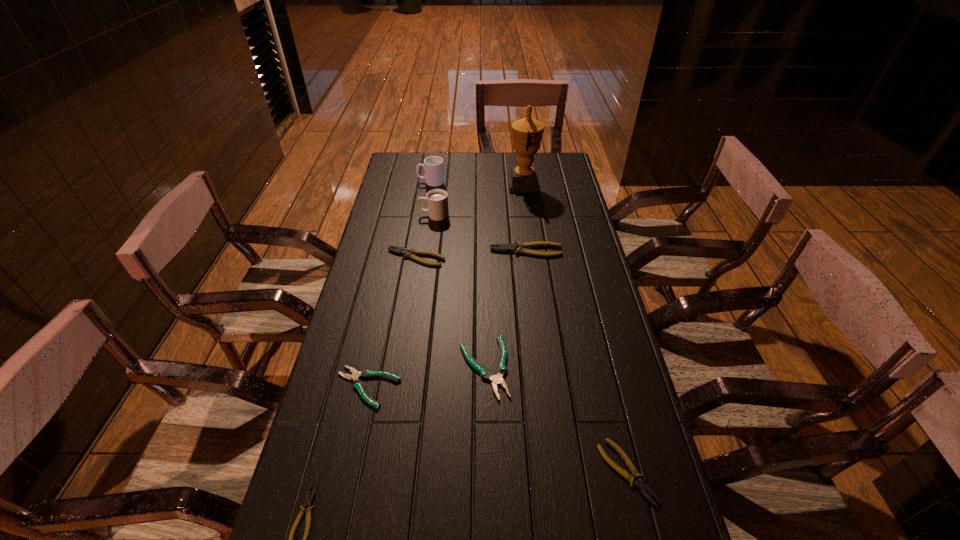
Locate an element on the screen. The height and width of the screenshot is (540, 960). the second smallest yellow pliers is located at coordinates (639, 483).

The image size is (960, 540). I want to click on the smaller teal pliers, so click(357, 384).

Identify the location of free region located at the front of the award with handles. (457, 184).

Find the location of a particular element. vacant position located 0.330m at the front of the award with handles is located at coordinates (431, 184).

At what (x,y) coordinates should I click in order to perform the action: click on vacant space situated at the front of the award with handles. Please return your answer as a coordinate pair (x, y). The height and width of the screenshot is (540, 960). Looking at the image, I should click on (441, 184).

The height and width of the screenshot is (540, 960). I want to click on free space located 0.140m on the side with the handle of the cappuccino, so click(x=383, y=215).

The height and width of the screenshot is (540, 960). I want to click on free space located on the side with the handle of the cappuccino, so click(x=403, y=215).

Image resolution: width=960 pixels, height=540 pixels. Find the location of `blank area located on the side with the handle of the cappuccino`. blank area located on the side with the handle of the cappuccino is located at coordinates (398, 215).

You are a GUI agent. You are given a task and a screenshot of the screen. Output one action in this format:
    pyautogui.click(x=<x>, y=<y>)
    Task: Click on the free region located 0.080m on the front of the biggest yellow pliers
    
    Given the screenshot: What is the action you would take?
    pyautogui.click(x=529, y=273)

This screenshot has height=540, width=960. In order to click on free space located on the back of the third yellow pliers from right to left in this screenshot , I will do `click(424, 210)`.